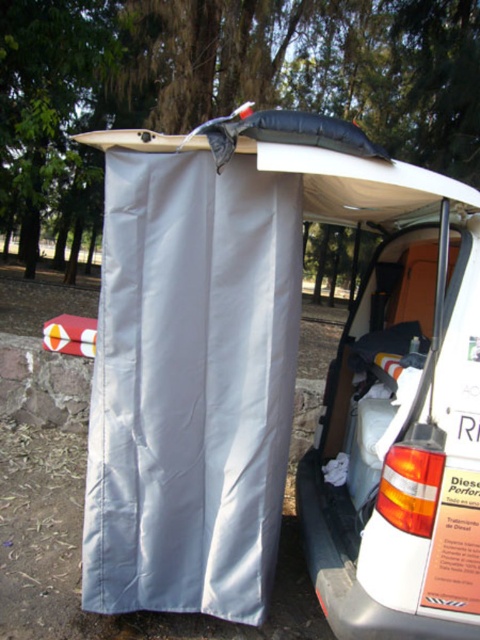
Question: Is white fabric curtain at center positioned at the back of white foam surfboard at center?

Choices:
 (A) yes
 (B) no

Answer: (A)

Question: Is white fabric curtain at center wider than white foam surfboard at center?

Choices:
 (A) no
 (B) yes

Answer: (A)

Question: Which point is farther to the camera?

Choices:
 (A) (244, 148)
 (B) (120, 429)

Answer: (B)

Question: Does white fabric curtain at center appear on the right side of white foam surfboard at center?

Choices:
 (A) yes
 (B) no

Answer: (B)